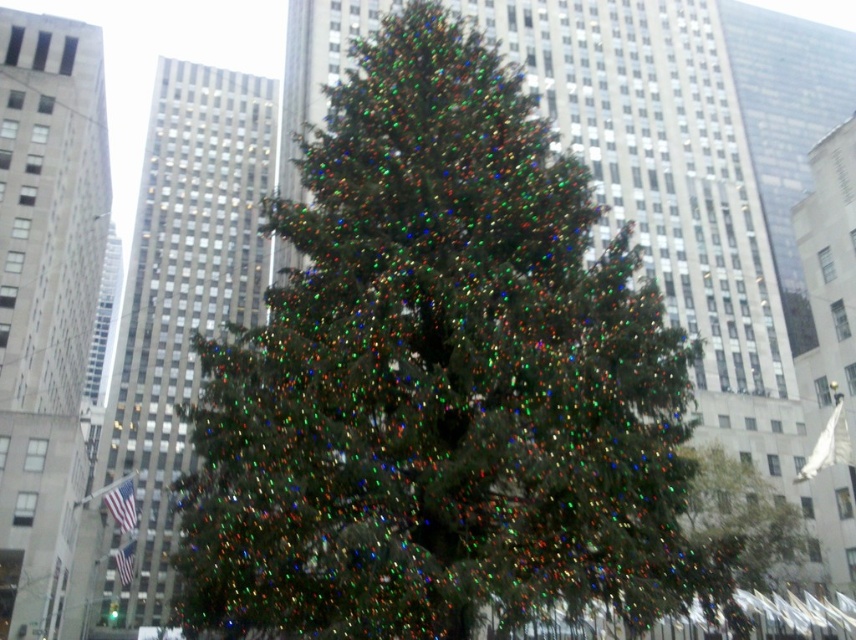
Question: Where is iridescent green pine tree at center located in relation to green matte tree at center in the image?

Choices:
 (A) above
 (B) below

Answer: (A)

Question: Which point is farther to the camera?

Choices:
 (A) iridescent green pine tree at center
 (B) green matte tree at center

Answer: (B)

Question: Is iridescent green pine tree at center below green matte tree at center?

Choices:
 (A) yes
 (B) no

Answer: (B)

Question: From the image, what is the correct spatial relationship of iridescent green pine tree at center in relation to green matte tree at center?

Choices:
 (A) above
 (B) below

Answer: (A)